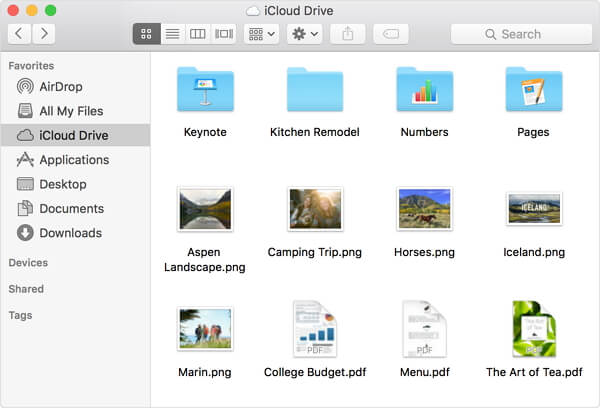
Locate an element on the screen. Image resolution: width=600 pixels, height=408 pixels. files is located at coordinates (534, 218), (437, 218), (308, 223), (200, 221), (196, 324), (300, 349), (421, 339), (514, 343).